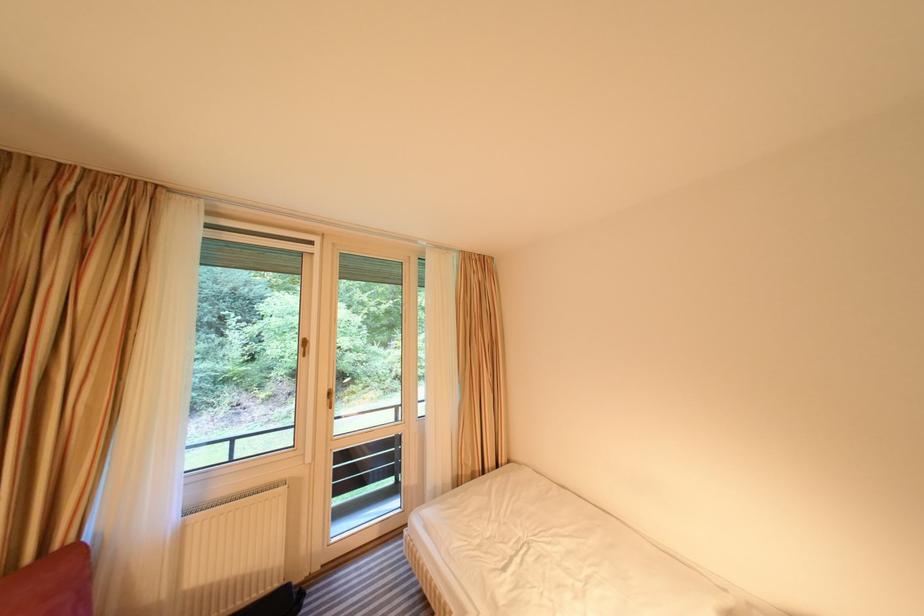
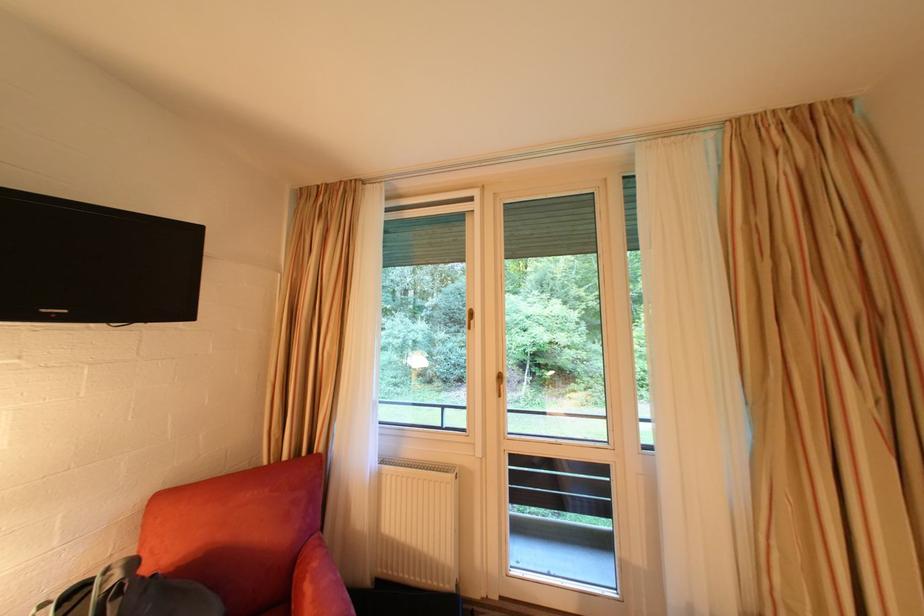
Question: The camera is either moving clockwise (left) or counter-clockwise (right) around the object. The first image is from the beginning of the video and the second image is from the end. Is the camera moving left or right when shooting the video?

Choices:
 (A) Left
 (B) Right

Answer: (B)